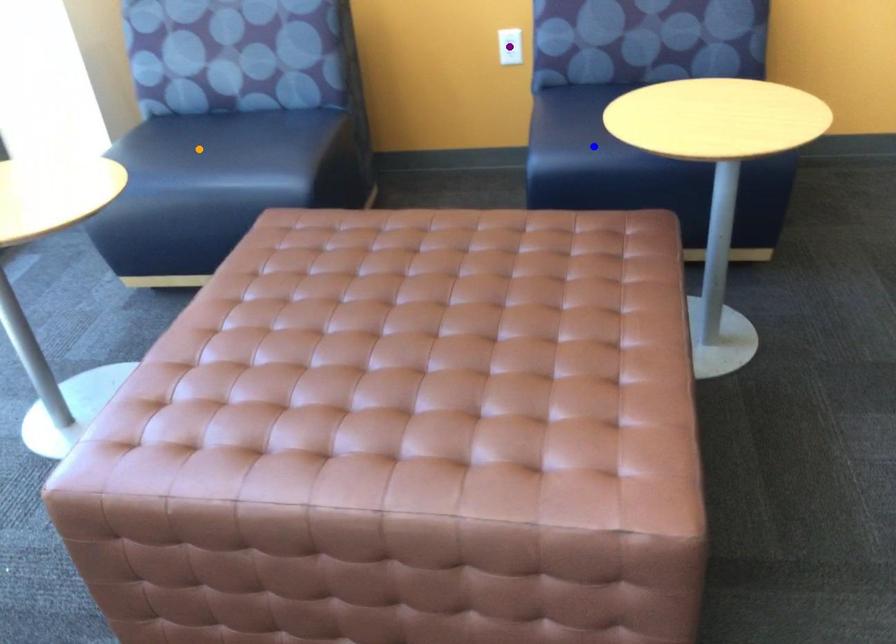
Order these from nearest to farthest:
A) purple point
B) orange point
C) blue point

blue point < orange point < purple point